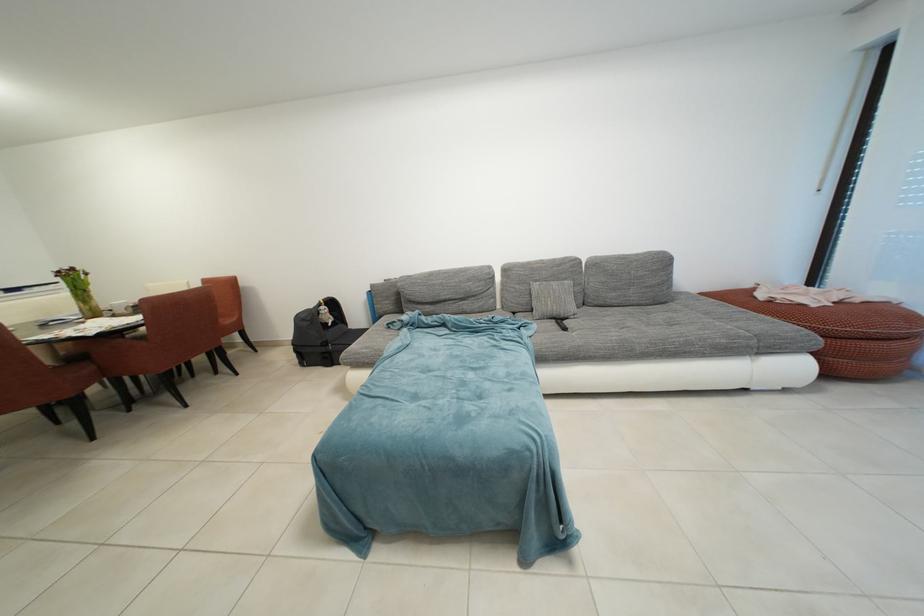
Where is `backpack zipper pull`? backpack zipper pull is located at coordinates (561, 323).